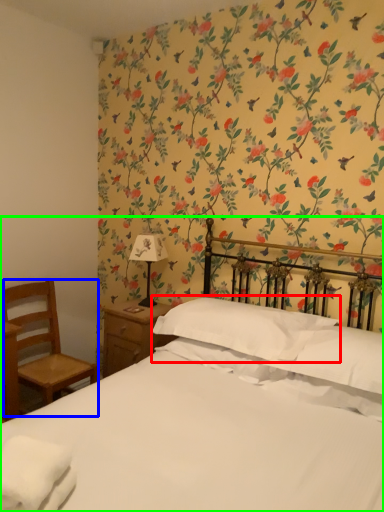
Question: Which object is the closest to the pillow (highlighted by a red box)? Choose among these: chair (highlighted by a blue box) or bed (highlighted by a green box).

Choices:
 (A) chair
 (B) bed

Answer: (B)